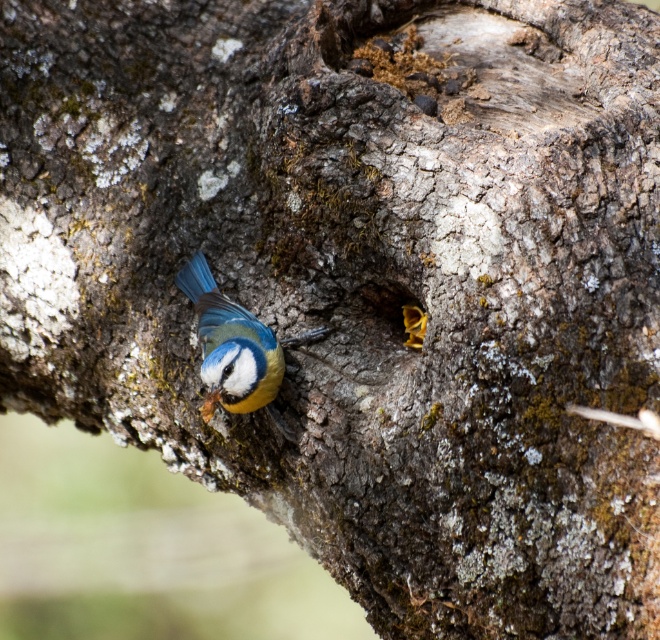
You are a birdwatcher observing the tree trunk. You see the blue matte bird at center and the yellow wood at center. Which object is positioned more to the left?

The blue matte bird at center is positioned more to the left than the yellow wood at center.

You are an ornithologist observing a tree trunk. You notice a blue matte bird at center and a yellow wood at center. Which object is bigger in size?

The blue matte bird at center is larger in size than the yellow wood at center.